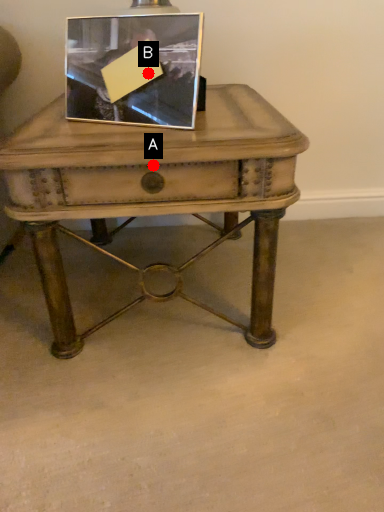
Question: Two points are circled on the image, labeled by A and B beside each circle. Which point is closer to the camera?

Choices:
 (A) A is closer
 (B) B is closer

Answer: (A)